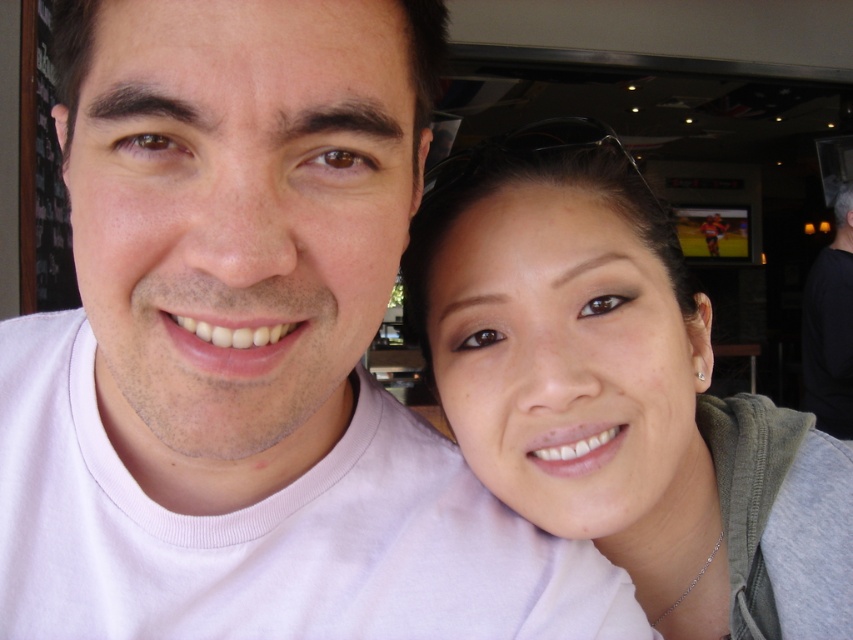
You are a photographer standing 10 feet away from the matte gray hoodie at right and the black matte hair at upper right. If you want to take a photo that includes both objects in the frame, will you need to zoom in or zoom out?

The matte gray hoodie at right and black matte hair at upper right are 7.87 feet apart. Since you are standing 10 feet away from both objects, you can zoom out slightly to ensure both objects are within the camera frame.

You are a photographer taking a picture of the matte gray hoodie at right and the black matte hair at upper right. Which object appears taller in the photo?

The black matte hair at upper right appears taller than the matte gray hoodie at right in the photo because the matte gray hoodie at right is not as tall as black matte hair at upper right.

You are a photographer standing in front of the matte gray hoodie at right. You want to take a closeup shot of it without moving the hoodie. What is the minimum distance you need to move backward or forward to achieve this?

The matte gray hoodie at right is 43.53 centimeters away from the viewer. To take a closeup shot without moving the hoodie, you would need to move forward until the distance between you and the hoodie is within the minimum focusing distance of your camera lens. However, if the current distance is already within the focusing range, no adjustment is needed. The exact distance depends on the camera specifications.